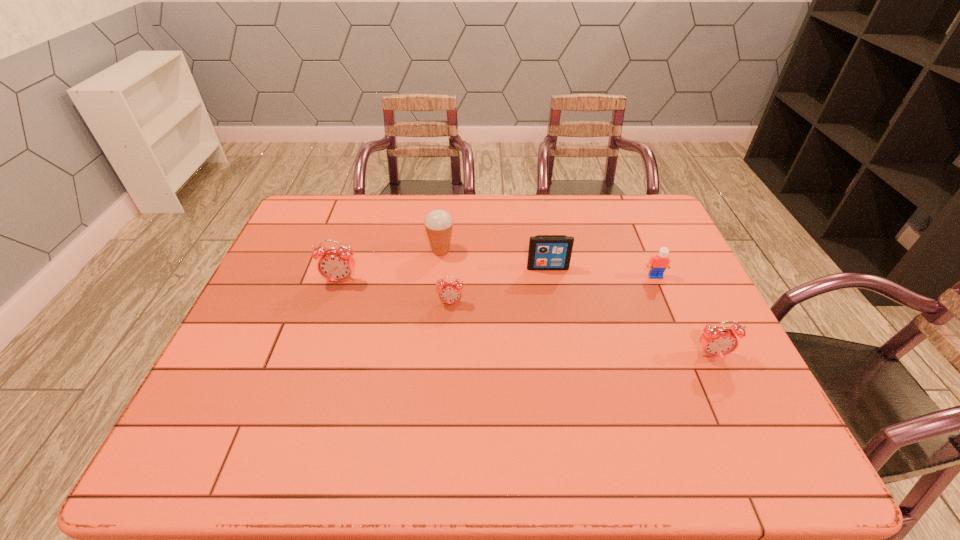
Point out which object is positioned as the nearest to the tallest alarm clock. Please provide its 2D coordinates. Your answer should be formatted as a tuple, i.e. [(x, y)], where the tuple contains the x and y coordinates of a point satisfying the conditions above.

[(438, 223)]

Locate an element on the screen. Image resolution: width=960 pixels, height=540 pixels. object that stands as the fourth closest to the Lego is located at coordinates (438, 223).

Image resolution: width=960 pixels, height=540 pixels. In order to click on alarm clock that stands as the closest to the fourth object from left to right in this screenshot , I will do `click(450, 292)`.

This screenshot has height=540, width=960. Find the location of `alarm clock that stands as the second closest to the second nearest object`. alarm clock that stands as the second closest to the second nearest object is located at coordinates (716, 341).